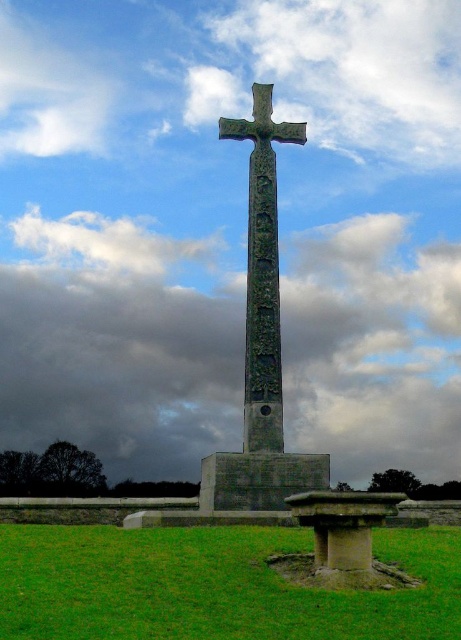
Is cloudy sky at center positioned behind green stone cross at center?

Yes.

Does cloudy sky at center have a lesser height compared to green stone cross at center?

Indeed, cloudy sky at center has a lesser height compared to green stone cross at center.

At what (x,y) coordinates should I click in order to perform the action: click on cloudy sky at center. Please return your answer as a coordinate pair (x, y). This screenshot has height=640, width=461. Looking at the image, I should click on (118, 346).

Identify the location of cloudy sky at center. (118, 346).

Can you confirm if cloudy sky at center is bigger than green grass at lower center?

Yes.

Is cloudy sky at center wider than green grass at lower center?

Correct, the width of cloudy sky at center exceeds that of green grass at lower center.

Which is behind, point (116, 301) or point (295, 596)?

The point (116, 301) is behind.

Locate an element on the screen. This screenshot has width=461, height=640. cloudy sky at center is located at coordinates (118, 346).

Does green grass at lower center have a greater width compared to green stone cross at center?

Indeed, green grass at lower center has a greater width compared to green stone cross at center.

Which is in front, point (200, 632) or point (278, 465)?

Point (200, 632) is more forward.

Which is in front, point (165, 598) or point (281, 420)?

Point (165, 598) is in front.

Find the location of a particular element. green grass at lower center is located at coordinates (213, 586).